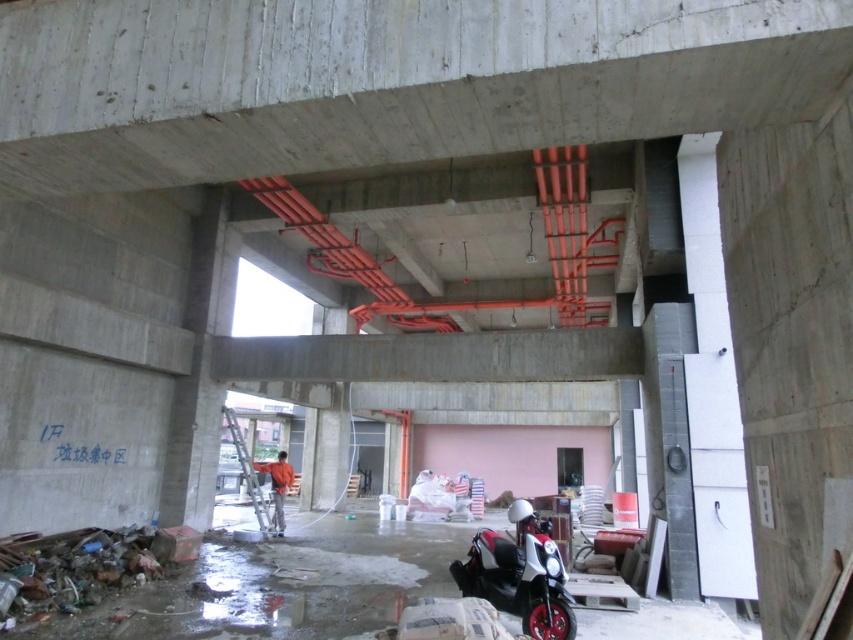
Question: Which is nearer to the concrete at center?

Choices:
 (A) orange fabric man at center
 (B) white glossy scooter at center

Answer: (B)

Question: Among these points, which one is farthest from the camera?

Choices:
 (A) (479, 570)
 (B) (253, 467)
 (C) (502, 150)

Answer: (B)

Question: Can you confirm if white glossy scooter at center is bigger than orange fabric man at center?

Choices:
 (A) yes
 (B) no

Answer: (B)

Question: Observing the image, what is the correct spatial positioning of concrete at center in reference to white glossy scooter at center?

Choices:
 (A) above
 (B) below

Answer: (A)

Question: Which object is the closest to the white glossy scooter at center?

Choices:
 (A) concrete at center
 (B) orange fabric man at center

Answer: (A)

Question: Does concrete at center appear on the left side of orange fabric man at center?

Choices:
 (A) no
 (B) yes

Answer: (A)